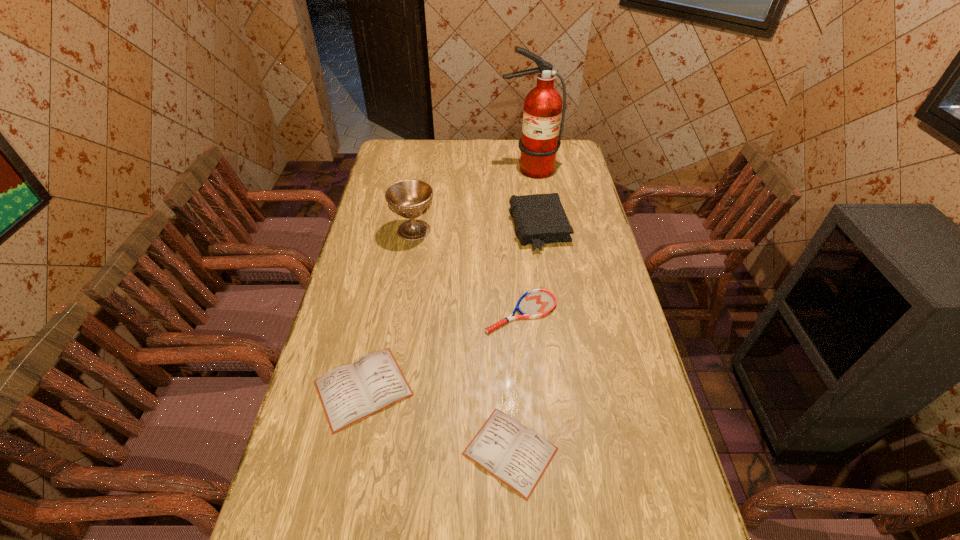
This screenshot has width=960, height=540. I want to click on unoccupied area between the chalice and the fire extinguisher, so click(471, 200).

Find the location of a particular element. vacant area that lies between the fourth tallest object and the chalice is located at coordinates click(389, 309).

Find the location of a particular element. vacant area between the fourth shortest object and the tennis racket is located at coordinates (530, 270).

Where is `free point between the shorter diary and the third tallest object`? free point between the shorter diary and the third tallest object is located at coordinates (524, 340).

Where is `free point between the fifth shortest object and the taller diary`? The image size is (960, 540). free point between the fifth shortest object and the taller diary is located at coordinates (389, 309).

Identify which object is located as the second nearest to the third tallest object. Please provide its 2D coordinates. Your answer should be formatted as a tuple, i.e. [(x, y)], where the tuple contains the x and y coordinates of a point satisfying the conditions above.

[(543, 104)]

Locate which object is the closest to the shorter diary. Please provide its 2D coordinates. Your answer should be formatted as a tuple, i.e. [(x, y)], where the tuple contains the x and y coordinates of a point satisfying the conditions above.

[(349, 393)]

Find the location of a particular element. free space in the image that satisfies the following two spatial constraints: 1. on the back side of the taller diary; 2. on the left side of the tennis racket is located at coordinates (379, 312).

Where is `vacant area in the image that satisfies the following two spatial constraints: 1. on the back side of the chalice; 2. on the right side of the taller diary`? The height and width of the screenshot is (540, 960). vacant area in the image that satisfies the following two spatial constraints: 1. on the back side of the chalice; 2. on the right side of the taller diary is located at coordinates (396, 230).

This screenshot has width=960, height=540. Find the location of `vacant point that satisfies the following two spatial constraints: 1. on the nozzle and handle of the fourth shortest object; 2. on the right side of the farthest object`. vacant point that satisfies the following two spatial constraints: 1. on the nozzle and handle of the fourth shortest object; 2. on the right side of the farthest object is located at coordinates (538, 228).